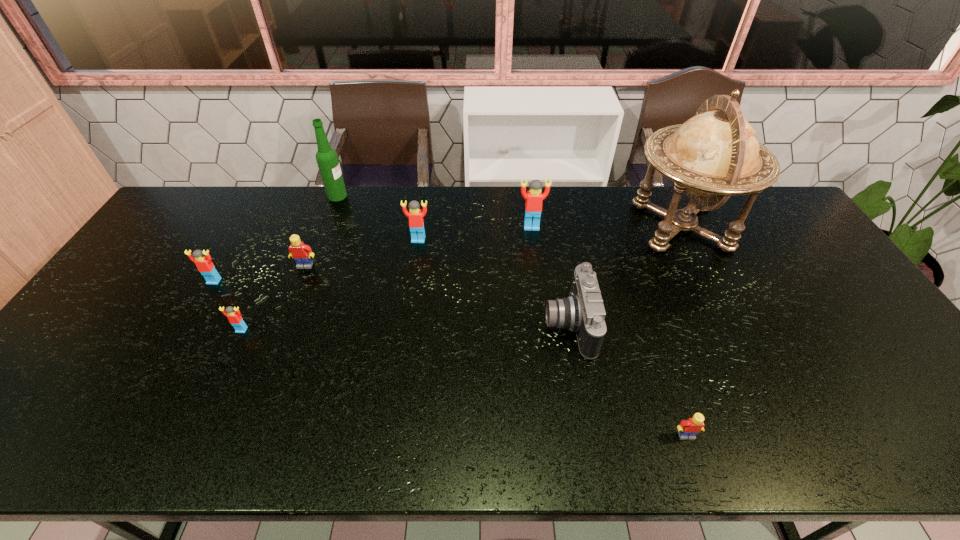
The height and width of the screenshot is (540, 960). I want to click on the leftmost object, so click(204, 265).

Find the location of a particular element. This screenshot has width=960, height=540. the fourth nearest Lego is located at coordinates (302, 253).

This screenshot has width=960, height=540. In order to click on the fourth Lego from right to left in this screenshot , I will do `click(302, 253)`.

Find the location of a particular element. the smallest red Lego is located at coordinates (233, 314).

The image size is (960, 540). Find the location of `the nearest red Lego`. the nearest red Lego is located at coordinates tap(233, 314).

Image resolution: width=960 pixels, height=540 pixels. I want to click on the nearer yellow Lego, so click(x=687, y=429).

Find the location of a particular element. This screenshot has height=540, width=960. the right yellow Lego is located at coordinates (687, 429).

At what (x,y) coordinates should I click in order to perform the action: click on vacant area located on the front-facing side of the globe. Please return your answer as a coordinate pair (x, y). The height and width of the screenshot is (540, 960). Looking at the image, I should click on (590, 226).

Locate an element on the screen. The width and height of the screenshot is (960, 540). free space located 0.130m on the front-facing side of the globe is located at coordinates [587, 226].

At what (x,y) coordinates should I click in order to perform the action: click on vacant area situated 0.400m on the front-facing side of the globe. Please return your answer as a coordinate pair (x, y). Looking at the image, I should click on (506, 226).